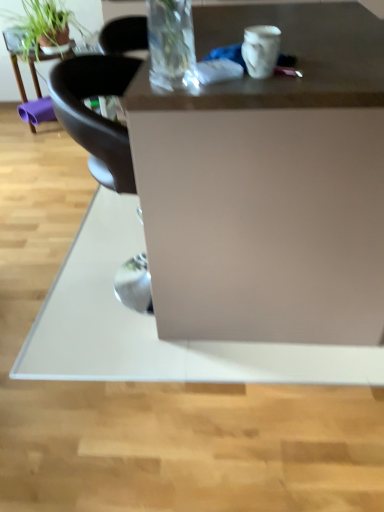
At what (x,y) coordinates should I click in order to perform the action: click on vacant space that is to the left of matte white desk at center. Please return your answer as a coordinate pair (x, y). The width and height of the screenshot is (384, 512). Looking at the image, I should click on (61, 251).